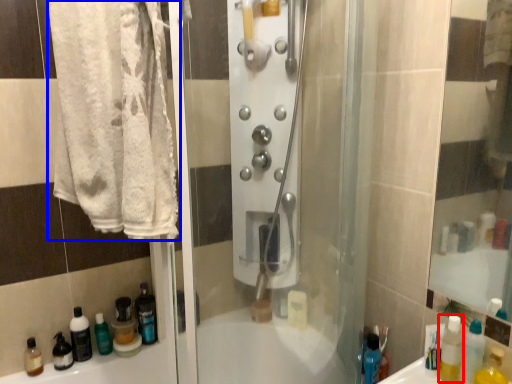
Question: Which object is further to the camera taking this photo, mouthwash (highlighted by a red box) or towel (highlighted by a blue box)?

Choices:
 (A) mouthwash
 (B) towel

Answer: (A)